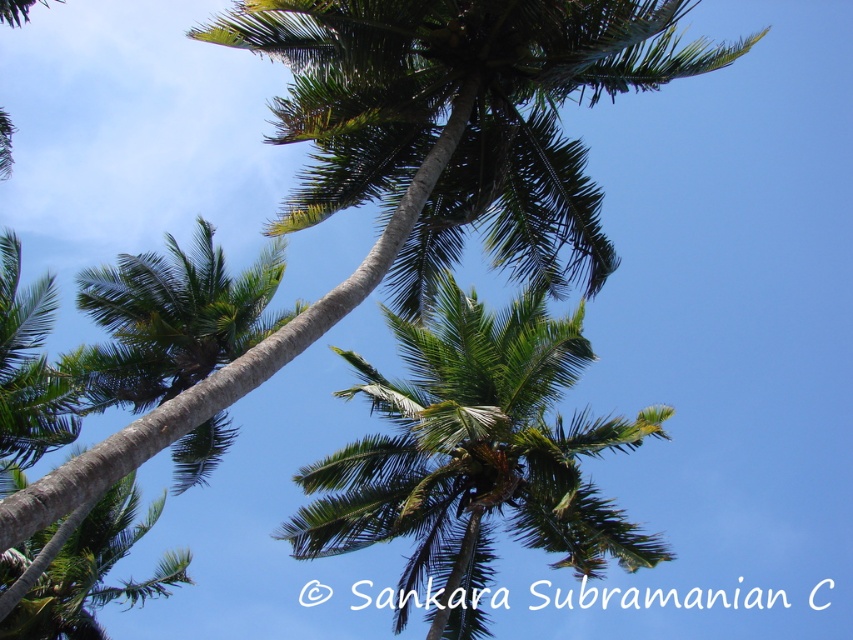
Question: Which of the following is the closest to the observer?

Choices:
 (A) [178, 308]
 (B) [570, 477]

Answer: (B)

Question: Where is green leafy palm tree at center located in relation to green leafy palm tree at upper left in the image?

Choices:
 (A) right
 (B) left

Answer: (A)

Question: Can you confirm if green leafy palm tree at center is positioned to the left of green leafy palm tree at upper left?

Choices:
 (A) yes
 (B) no

Answer: (B)

Question: From the image, what is the correct spatial relationship of green leafy palm tree at center in relation to green leafy palm tree at upper left?

Choices:
 (A) above
 (B) below

Answer: (B)

Question: Which point is farther to the camera?

Choices:
 (A) green leafy palm tree at center
 (B) green leafy palm tree at upper left

Answer: (B)